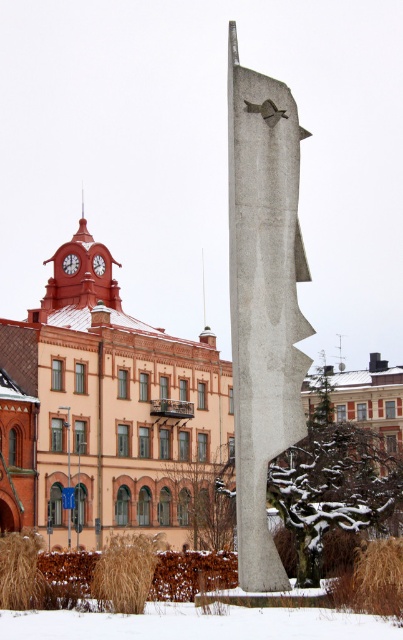
Can you confirm if brown grass at lower left is smaller than red painted metal clock at center?

Incorrect, brown grass at lower left is not smaller in size than red painted metal clock at center.

Does brown grass at lower left appear on the left side of red painted metal clock at center?

No, brown grass at lower left is not to the left of red painted metal clock at center.

Does point (26, 540) lie behind point (62, 262)?

No, (26, 540) is in front of (62, 262).

You are a GUI agent. You are given a task and a screenshot of the screen. Output one action in this format:
    pyautogui.click(x=<x>, y=<y>)
    Task: Click on the brown grass at lower left
    This screenshot has height=640, width=403.
    Given the screenshot: What is the action you would take?
    pyautogui.click(x=20, y=572)

Is gray concrete sculpture at center below brown grass at lower left?

Incorrect, gray concrete sculpture at center is not positioned below brown grass at lower left.

Which is more to the left, gray concrete sculpture at center or brown grass at lower left?

brown grass at lower left

Who is more forward, (267, 288) or (16, 582)?

Point (267, 288) is more forward.

This screenshot has height=640, width=403. I want to click on gray concrete sculpture at center, so click(263, 300).

Who is more forward, (257, 288) or (103, 260)?

Positioned in front is point (257, 288).

In the scene shown: Between gray concrete sculpture at center and matte red clock at upper left, which one has more height?

With more height is gray concrete sculpture at center.

Locate an element on the screen. gray concrete sculpture at center is located at coordinates (263, 300).